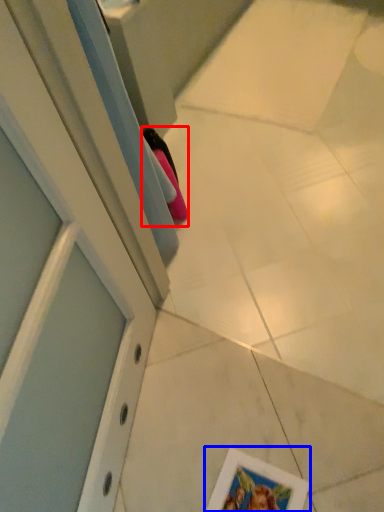
Question: Among these objects, which one is nearest to the camera, shoe (highlighted by a red box) or picture frame (highlighted by a blue box)?

Choices:
 (A) shoe
 (B) picture frame

Answer: (B)